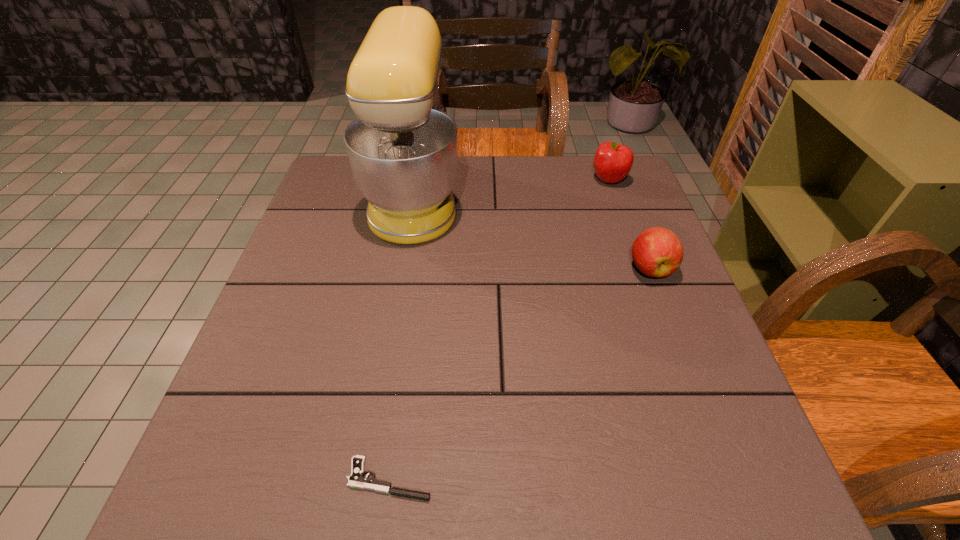
Where is `vacant position located 0.220m on the front-facing side of the nearest object`? Image resolution: width=960 pixels, height=540 pixels. vacant position located 0.220m on the front-facing side of the nearest object is located at coordinates (207, 479).

In order to click on mixer at the far edge in this screenshot , I will do `click(403, 149)`.

You are a GUI agent. You are given a task and a screenshot of the screen. Output one action in this format:
    pyautogui.click(x=<x>, y=<y>)
    Task: Click on the apple that is at the far edge
    This screenshot has height=540, width=960.
    Given the screenshot: What is the action you would take?
    pyautogui.click(x=612, y=162)

Where is `object at the near edge`? The width and height of the screenshot is (960, 540). object at the near edge is located at coordinates (356, 480).

Identify the location of object that is at the left edge. The height and width of the screenshot is (540, 960). (403, 149).

Identify the location of object at the far left corner. This screenshot has height=540, width=960. (403, 149).

You are a GUI agent. You are given a task and a screenshot of the screen. Output one action in this format:
    pyautogui.click(x=<x>, y=<y>)
    Task: Click on the object that is at the far right corner
    The height and width of the screenshot is (540, 960).
    Given the screenshot: What is the action you would take?
    pyautogui.click(x=612, y=162)

Locate an element on the screen. vacant space at the far edge of the desktop is located at coordinates (532, 173).

In the image, there is a desktop. Identify the location of free space at the near edge. (586, 494).

What are the coordinates of `vacant space at the left edge` in the screenshot? It's located at (232, 405).